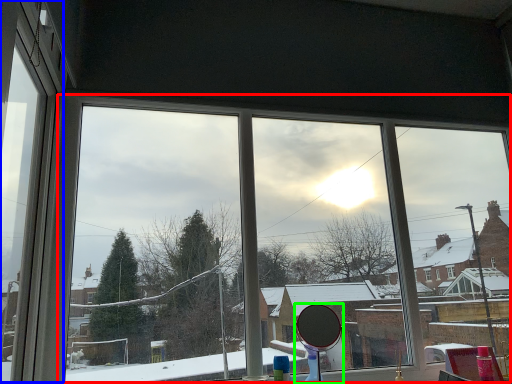
Question: Which is farther away from bay window (highlighted by a red box)? window frame (highlighted by a blue box) or mirror (highlighted by a green box)?

Choices:
 (A) window frame
 (B) mirror

Answer: (A)